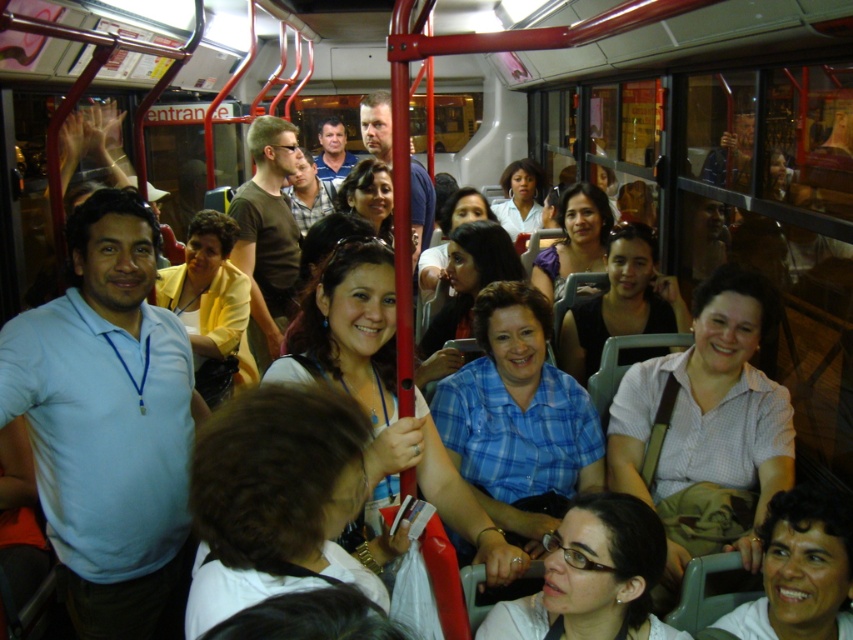
You are a photographer taking a picture of the passengers inside the crowded public bus. You notice the white checkered shirt at center and the smooth skin face at lower right. Which object should you focus on if you want to capture something taller in the scene?

The white checkered shirt at center has a greater height compared to the smooth skin face at lower right, so you should focus on the white checkered shirt at center to capture something taller in the scene.

You are a passenger on a crowded night bus and need to decide which shirt to wear tomorrow to ensure you can easily spot someone from a distance. Based on the image, which of the two shirts, the white checkered shirt at center or the matte white shirt at lower center, would be more visible due to its larger size?

The white checkered shirt at center has a greater width than the matte white shirt at lower center, making it more visible from a distance due to its larger size.

In the scene shown: You are a photographer taking a picture of the passengers on the crowded public bus. You notice the light blue cotton shirt at center and the matte white shirt at lower center. Which of these two shirts would appear larger in your photo?

The light blue cotton shirt at center would appear larger in the photo because it is bigger than the matte white shirt at lower center.